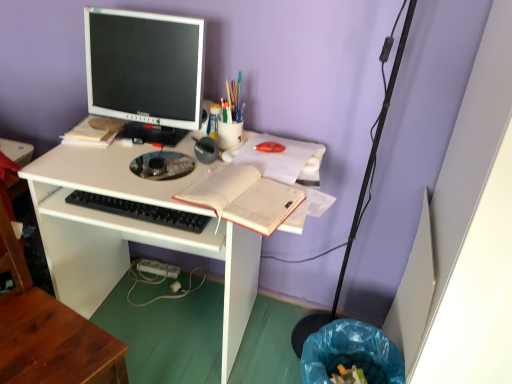
Locate an element on the screen. vacant region under white matte desk at center (from a real-world perspective) is located at coordinates (208, 338).